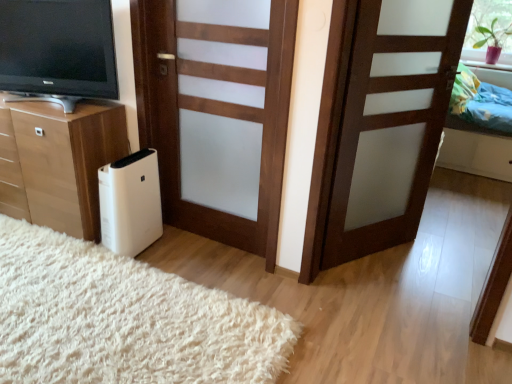
Locate an element on the screen. The height and width of the screenshot is (384, 512). brown matte door at center, which appears as the first door when viewed from the right is located at coordinates [x=389, y=120].

Describe the element at coordinates (58, 162) in the screenshot. I see `wooden chest of drawers at lower left` at that location.

What do you see at coordinates (477, 153) in the screenshot? The height and width of the screenshot is (384, 512). I see `multicolored fabric bed at upper right` at bounding box center [477, 153].

This screenshot has height=384, width=512. What do you see at coordinates (124, 319) in the screenshot? I see `white soft rug at lower left` at bounding box center [124, 319].

What are the coordinates of `brown matte door at center, which is the second door in left-to-right order` in the screenshot? It's located at (389, 120).

Is there a large distance between white plastic air purifier at lower left and white soft rug at lower left?

white plastic air purifier at lower left is near white soft rug at lower left, not far away.

From the picture: Is white plastic air purifier at lower left positioned beyond the bounds of white soft rug at lower left?

white plastic air purifier at lower left lies outside white soft rug at lower left's area.

From the image's perspective, which object appears higher, white plastic air purifier at lower left or white soft rug at lower left?

white plastic air purifier at lower left appears higher in the image.

How many degrees apart are the facing directions of white plastic air purifier at lower left and white soft rug at lower left?

The angular difference between white plastic air purifier at lower left and white soft rug at lower left is 85.8 degrees.

Between wooden chest of drawers at lower left and wooden door at center, marked as the first door in a left-to-right arrangement, which one is positioned in front?

wooden door at center, marked as the first door in a left-to-right arrangement, is more forward.

Is wooden chest of drawers at lower left not inside wooden door at center, marked as the first door in a left-to-right arrangement?

Absolutely, wooden chest of drawers at lower left is external to wooden door at center, marked as the first door in a left-to-right arrangement.

Consider the image. Would you say wooden chest of drawers at lower left is a long distance from wooden door at center, placed as the second door when sorted from right to left?

wooden chest of drawers at lower left is near wooden door at center, placed as the second door when sorted from right to left, not far away.

Considering the relative sizes of wooden chest of drawers at lower left and wooden door at center, placed as the second door when sorted from right to left, in the image provided, is wooden chest of drawers at lower left wider than wooden door at center, placed as the second door when sorted from right to left,?

In fact, wooden chest of drawers at lower left might be narrower than wooden door at center, placed as the second door when sorted from right to left.

From a real-world perspective, which is physically above, matte black television at left or wooden chest of drawers at lower left?

matte black television at left, from a real-world perspective.

Is matte black television at left positioned beyond the bounds of wooden chest of drawers at lower left?

Yes, matte black television at left is not within wooden chest of drawers at lower left.

Looking at this image, is matte black television at left shorter than wooden chest of drawers at lower left?

Indeed, matte black television at left has a lesser height compared to wooden chest of drawers at lower left.

Is matte black television at left oriented towards wooden chest of drawers at lower left?

No, matte black television at left is not aimed at wooden chest of drawers at lower left.

From the image's perspective, which one is positioned lower, wooden chest of drawers at lower left or green matte plant at upper right?

wooden chest of drawers at lower left, from the image's perspective.

Is wooden chest of drawers at lower left not near green matte plant at upper right?

Absolutely, wooden chest of drawers at lower left is distant from green matte plant at upper right.

Which object is more forward, wooden chest of drawers at lower left or green matte plant at upper right?

wooden chest of drawers at lower left is closer to the camera.

Which is correct: wooden chest of drawers at lower left is inside green matte plant at upper right, or outside of it?

wooden chest of drawers at lower left is located beyond the bounds of green matte plant at upper right.

Consider the image. Who is bigger, multicolored fabric bed at upper right or white soft rug at lower left?

multicolored fabric bed at upper right is bigger.

Does multicolored fabric bed at upper right turn towards white soft rug at lower left?

No, multicolored fabric bed at upper right is not facing towards white soft rug at lower left.

Between point (449, 158) and point (53, 293), which one is positioned in front?

The point (53, 293) is closer.

Locate an element on the screen. bed above the white soft rug at lower left (from the image's perspective) is located at coordinates (477, 153).

Which object is further away from the camera, green matte plant at upper right or matte black television at left?

green matte plant at upper right is more distant.

Which object is positioned more to the right, green matte plant at upper right or matte black television at left?

From the viewer's perspective, green matte plant at upper right appears more on the right side.

Which of these two, green matte plant at upper right or matte black television at left, is smaller?

With smaller size is green matte plant at upper right.

Does green matte plant at upper right have a lesser width compared to matte black television at left?

Incorrect, the width of green matte plant at upper right is not less than that of matte black television at left.

From a real-world perspective, is wooden door at center, placed as the second door when sorted from right to left, physically located above or below wooden chest of drawers at lower left?

wooden door at center, placed as the second door when sorted from right to left, is situated higher than wooden chest of drawers at lower left in the real world.

Where is `the 1st door in front of the wooden chest of drawers at lower left`? The image size is (512, 384). the 1st door in front of the wooden chest of drawers at lower left is located at coordinates (218, 113).

Is wooden door at center, marked as the first door in a left-to-right arrangement, not near wooden chest of drawers at lower left?

No.

Consider the image. Who is shorter, wooden door at center, placed as the second door when sorted from right to left, or wooden chest of drawers at lower left?

With less height is wooden chest of drawers at lower left.

I want to click on appliance on the right of white soft rug at lower left, so click(130, 203).

Where is `the chest of drawers beneath the wooden door at center, marked as the first door in a left-to-right arrangement (from a real-world perspective)`? Image resolution: width=512 pixels, height=384 pixels. the chest of drawers beneath the wooden door at center, marked as the first door in a left-to-right arrangement (from a real-world perspective) is located at coordinates coord(58,162).

Looking at the image, which one is located closer to green matte plant at upper right, white plastic air purifier at lower left or matte black television at left?

white plastic air purifier at lower left is closer to green matte plant at upper right.

When comparing their distances from white plastic air purifier at lower left, does wooden door at center, marked as the first door in a left-to-right arrangement, or multicolored fabric bed at upper right seem further?

multicolored fabric bed at upper right is further to white plastic air purifier at lower left.

From the image, which object appears to be nearer to brown matte door at center, which appears as the first door when viewed from the right, wooden chest of drawers at lower left or wooden door at center, placed as the second door when sorted from right to left?

wooden door at center, placed as the second door when sorted from right to left, lies closer to brown matte door at center, which appears as the first door when viewed from the right, than the other object.

Based on their spatial positions, is white soft rug at lower left or white plastic air purifier at lower left closer to matte black television at left?

The object closer to matte black television at left is white plastic air purifier at lower left.

Considering their positions, is wooden chest of drawers at lower left positioned further to matte black television at left than brown matte door at center, which is the second door in left-to-right order?

brown matte door at center, which is the second door in left-to-right order, is positioned further to the anchor matte black television at left.

From the picture: Which object lies further to the anchor point white soft rug at lower left, brown matte door at center, which is the second door in left-to-right order, or white plastic air purifier at lower left?

Based on the image, brown matte door at center, which is the second door in left-to-right order, appears to be further to white soft rug at lower left.

Looking at the image, which one is located closer to brown matte door at center, which is the second door in left-to-right order, wooden chest of drawers at lower left or matte black television at left?

wooden chest of drawers at lower left lies closer to brown matte door at center, which is the second door in left-to-right order, than the other object.

Based on their spatial positions, is multicolored fabric bed at upper right or brown matte door at center, which is the second door in left-to-right order, closer to white plastic air purifier at lower left?

brown matte door at center, which is the second door in left-to-right order, is closer to white plastic air purifier at lower left.

Locate an element on the screen. The image size is (512, 384). bed between matte black television at left and green matte plant at upper right in the horizontal direction is located at coordinates (477, 153).

Identify the location of appliance between matte black television at left and brown matte door at center, which is the second door in left-to-right order. (130, 203).

You are a GUI agent. You are given a task and a screenshot of the screen. Output one action in this format:
    pyautogui.click(x=<x>, y=<y>)
    Task: Click on the television situated between wooden chest of drawers at lower left and wooden door at center, marked as the first door in a left-to-right arrangement, from left to right
    
    Given the screenshot: What is the action you would take?
    pyautogui.click(x=57, y=51)

Identify the location of chest of drawers between matte black television at left and white plastic air purifier at lower left from top to bottom. (58, 162).